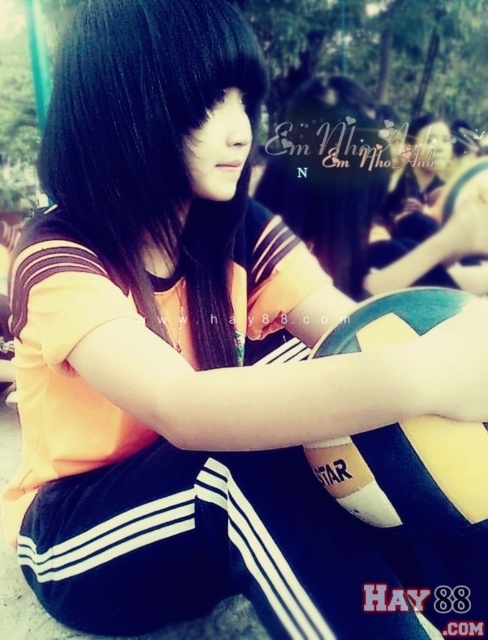
Question: Which point is closer to the camera?

Choices:
 (A) (247, 170)
 (B) (422, 432)

Answer: (B)

Question: Is black glossy hair at center to the left of blue rubber beach ball at center from the viewer's perspective?

Choices:
 (A) no
 (B) yes

Answer: (B)

Question: Does black glossy hair at center appear on the left side of blue rubber beach ball at center?

Choices:
 (A) no
 (B) yes

Answer: (B)

Question: Can you confirm if black glossy hair at center is wider than blue rubber beach ball at center?

Choices:
 (A) yes
 (B) no

Answer: (A)